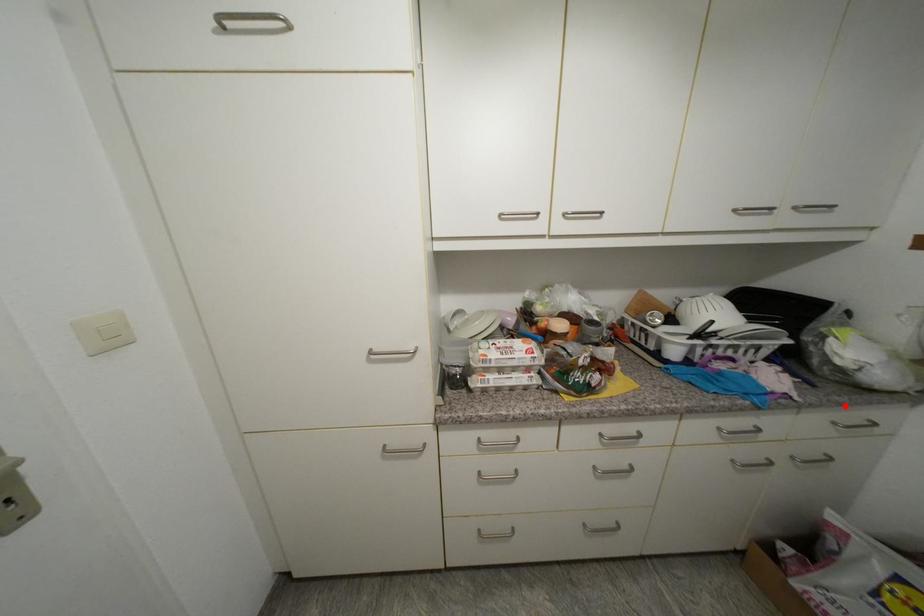
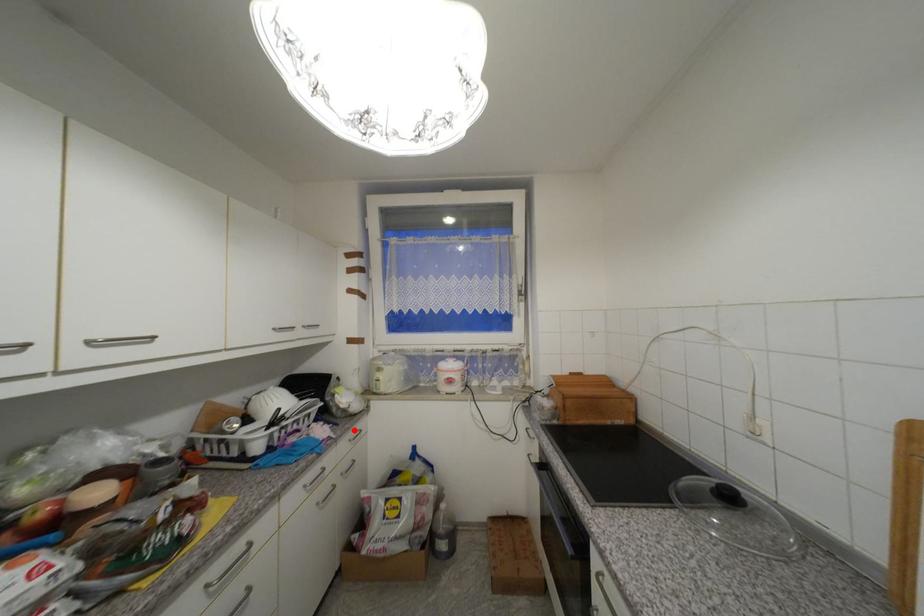
I am providing you with two images of the same scene from different viewpoints. A red point is marked on the first image and another point is marked on the second image. Do the highlighted points in image1 and image2 indicate the same real-world spot?

Yes